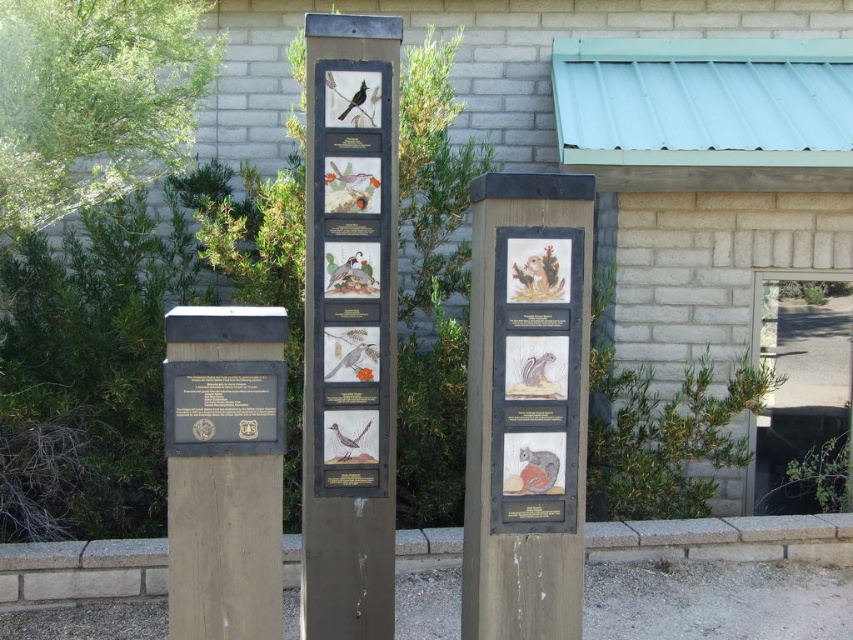
Question: Is matte wooden plaque at center positioned in front of black polished stone plaque at center?

Choices:
 (A) no
 (B) yes

Answer: (A)

Question: Observing the image, what is the correct spatial positioning of matte gray signpost at center in reference to black polished stone plaque at center?

Choices:
 (A) right
 (B) left

Answer: (A)

Question: Which point is closer to the camera taking this photo?

Choices:
 (A) (386, 428)
 (B) (219, 362)

Answer: (B)

Question: Estimate the real-world distances between objects in this image. Which object is farther from the black polished stone plaque at center?

Choices:
 (A) matte wooden plaque at center
 (B) wooden signpost at center
 (C) matte gray signpost at center

Answer: (A)

Question: Which point appears farthest from the camera in this image?

Choices:
 (A) (540, 291)
 (B) (373, 580)
 (C) (511, 488)

Answer: (B)

Question: Does black polished wood sign at left lie in front of matte wooden plaque at center?

Choices:
 (A) yes
 (B) no

Answer: (A)